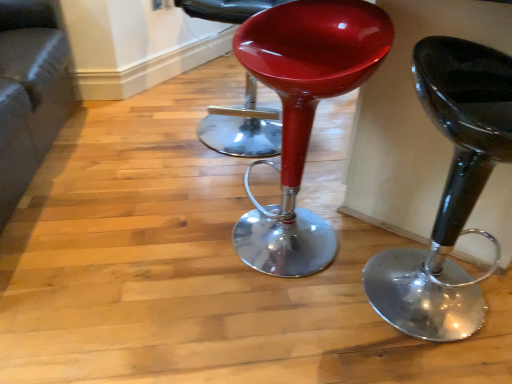
Where is `free point behind glossy plastic stool at center, which is counted as the 1th stool, starting from the left`? The image size is (512, 384). free point behind glossy plastic stool at center, which is counted as the 1th stool, starting from the left is located at coordinates (296, 198).